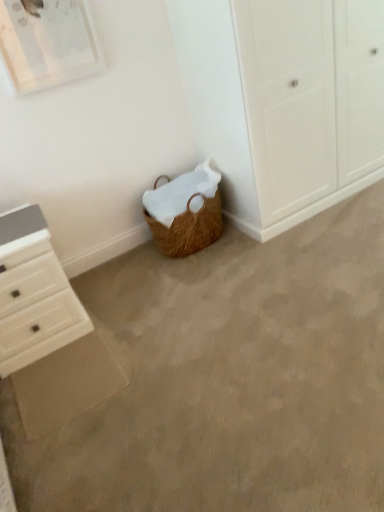
Question: From the image's perspective, is braided wicker basket at lower center located above or below white wood chest of drawers at lower left?

Choices:
 (A) above
 (B) below

Answer: (B)

Question: In terms of size, does braided wicker basket at lower center appear bigger or smaller than white wood chest of drawers at lower left?

Choices:
 (A) big
 (B) small

Answer: (A)

Question: Considering the positions of point (284, 357) and point (36, 246), is point (284, 357) closer or farther from the camera than point (36, 246)?

Choices:
 (A) closer
 (B) farther

Answer: (A)

Question: Relative to braided wicker basket at lower center, is white wood chest of drawers at lower left in front or behind?

Choices:
 (A) front
 (B) behind

Answer: (B)

Question: Do you think white wood chest of drawers at lower left is within braided wicker basket at lower center, or outside of it?

Choices:
 (A) outside
 (B) inside

Answer: (A)

Question: Considering the positions of white wood chest of drawers at lower left and braided wicker basket at lower center in the image, is white wood chest of drawers at lower left wider or thinner than braided wicker basket at lower center?

Choices:
 (A) wide
 (B) thin

Answer: (B)

Question: From a real-world perspective, relative to braided wicker basket at lower center, is white wood chest of drawers at lower left vertically above or below?

Choices:
 (A) below
 (B) above

Answer: (B)